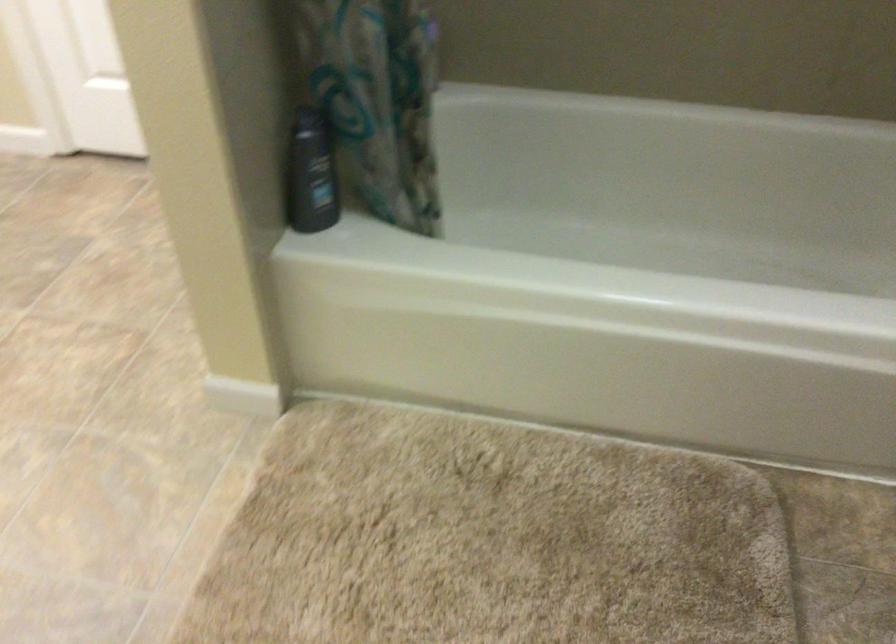
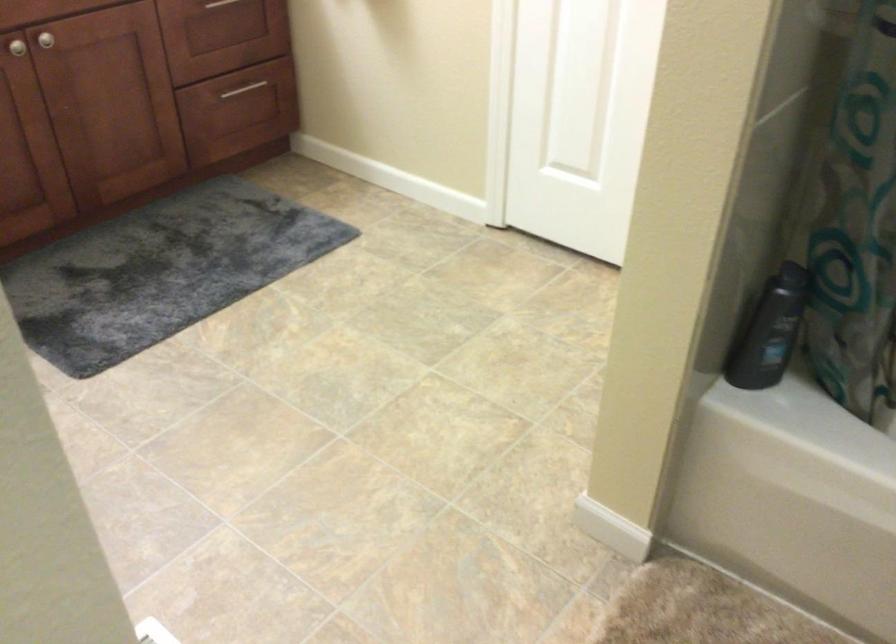
Question: The camera is either moving clockwise (left) or counter-clockwise (right) around the object. The first image is from the beginning of the video and the second image is from the end. Is the camera moving left or right when shooting the video?

Choices:
 (A) Left
 (B) Right

Answer: (B)